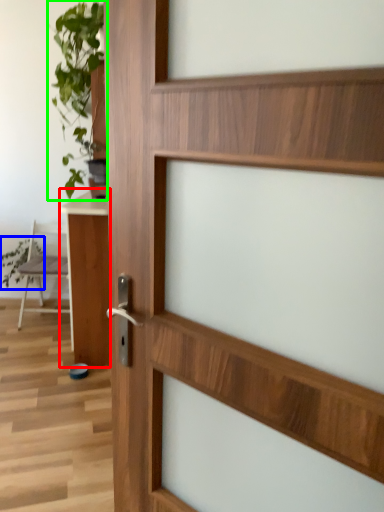
Question: Which is nearer to the table (highlighted by a red box)? plant (highlighted by a blue box) or houseplant (highlighted by a green box).

Choices:
 (A) plant
 (B) houseplant

Answer: (B)